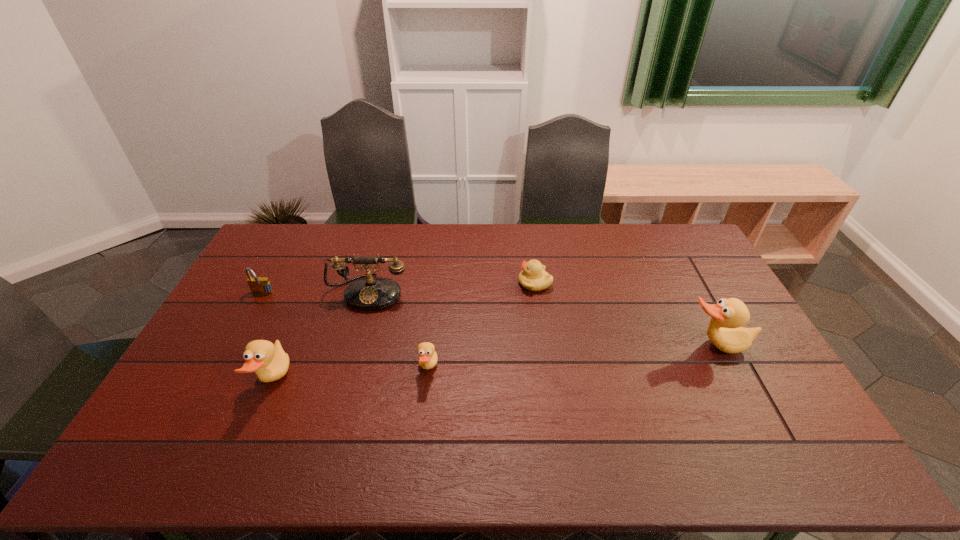
You are a GUI agent. You are given a task and a screenshot of the screen. Output one action in this format:
    pyautogui.click(x=<x>, y=<y>)
    Task: Click on the vacant space situated on the beak of the rightmost object
    
    Given the screenshot: What is the action you would take?
    pyautogui.click(x=747, y=407)

The height and width of the screenshot is (540, 960). Find the location of `vacant space located 0.400m on the side with the combination dials of the leftmost object`. vacant space located 0.400m on the side with the combination dials of the leftmost object is located at coordinates (204, 404).

You are a GUI agent. You are given a task and a screenshot of the screen. Output one action in this format:
    pyautogui.click(x=<x>, y=<y>)
    Task: Click on the vacant space located 0.150m on the beak of the duckling
    This screenshot has width=960, height=540.
    Given the screenshot: What is the action you would take?
    pyautogui.click(x=475, y=284)

Where is `vacant space located 0.220m on the beak of the duckling`? vacant space located 0.220m on the beak of the duckling is located at coordinates (454, 284).

I want to click on free location located on the beak of the duckling, so click(498, 284).

Where is `vacant space located on the dial of the telephone`? The image size is (960, 540). vacant space located on the dial of the telephone is located at coordinates (349, 361).

Identify the location of object that is at the near edge. This screenshot has width=960, height=540. (269, 361).

The width and height of the screenshot is (960, 540). Identify the location of object located in the left edge section of the desktop. (259, 285).

Locate an element on the screen. This screenshot has height=540, width=960. object that is at the right edge is located at coordinates (725, 331).

Locate an element on the screen. vacant area at the far edge of the desktop is located at coordinates (435, 231).